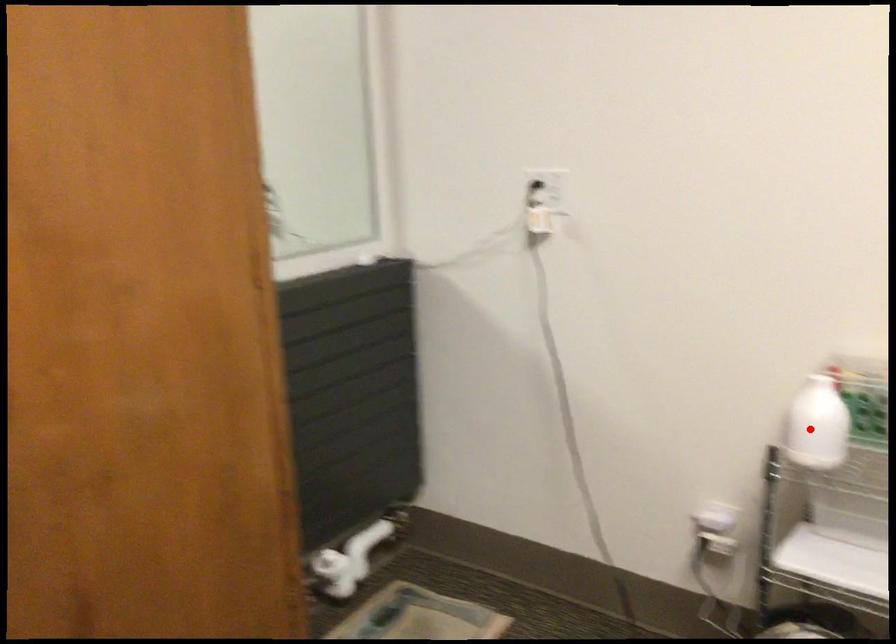
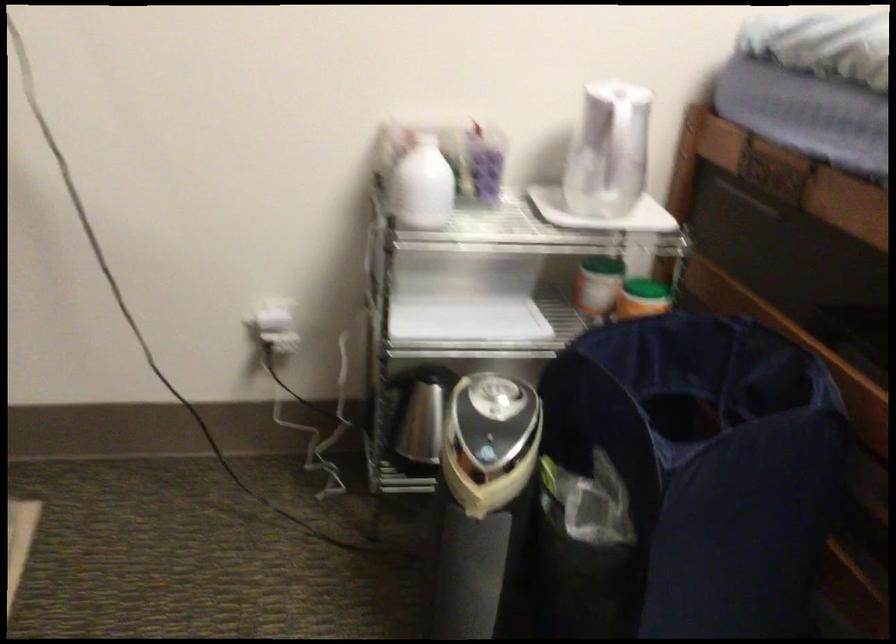
Find the pixel in the second image that matches the highlighted location in the first image.

(421, 185)